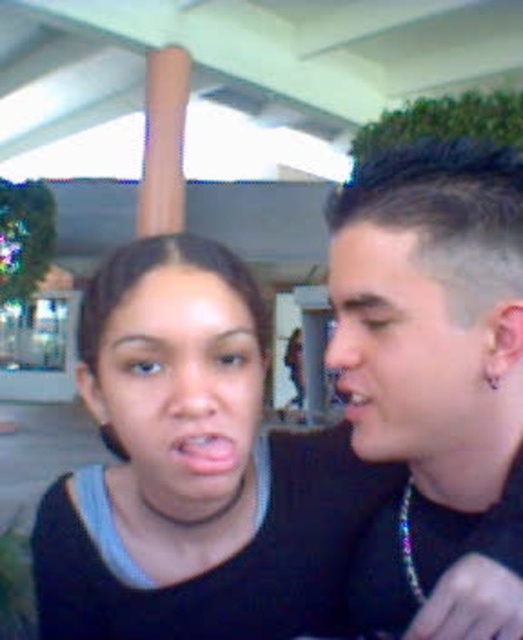
You are a makeup artist observing two people in the image. The first person has pink matte lips at center and the second has a matte black mouth at right. Which of their mouths has a smaller height?

The pink matte lips at center has a lesser height compared to the matte black mouth at right, so the pink matte lips at center is smaller in height.

You are a photographer setting up a shot of the two people in the image. You need to focus on the pink matte lips at center located at point (204, 451). Is there any part of their clothing that might be in the way of the focus? Please check the black top with light blue collar and the black shirt.

The pink matte lips at center are located at point (204, 451). The black top with light blue collar and the black shirt are clothing items worn by the two individuals. Since the lips are at the specified coordinate, there is no mention of clothing covering that exact point, so the focus should be clear unless physically obstructed by another object not mentioned.